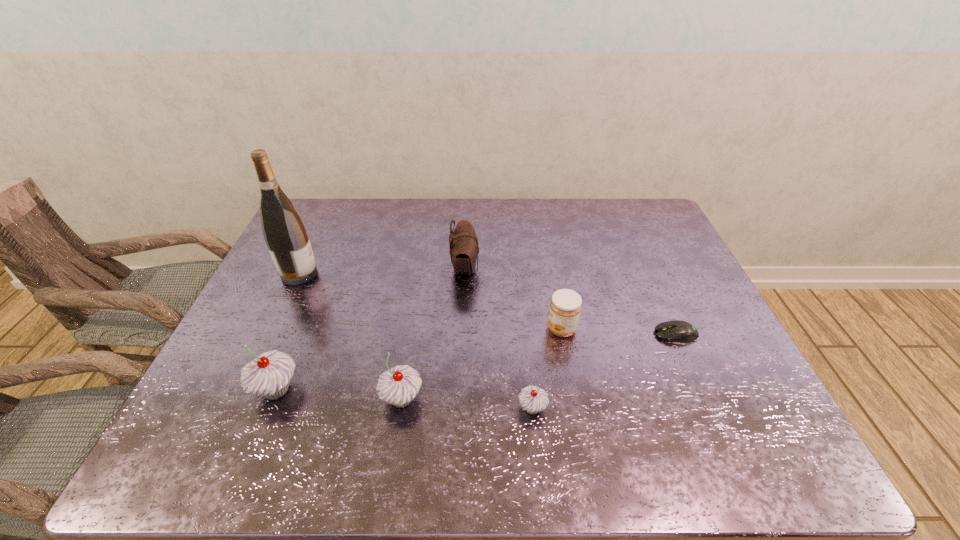
In the current image, all cupcakes are evenly spaced. To maintain this equal spacing, where should an additional cupcake be placed on the right? Please point out a free spot. Please provide its 2D coordinates. Your answer should be formatted as a tuple, i.e. [(x, y)], where the tuple contains the x and y coordinates of a point satisfying the conditions above.

[(668, 418)]